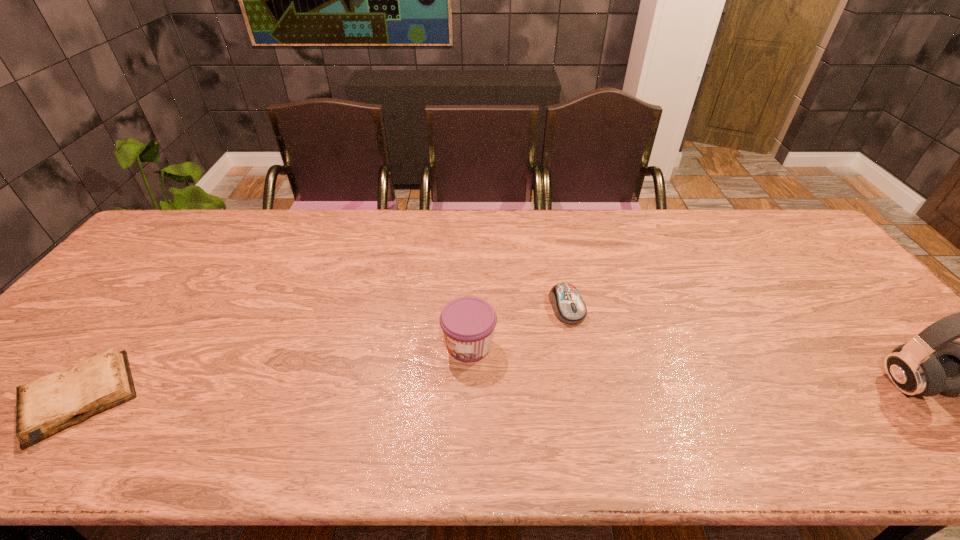
Locate an element on the screen. This screenshot has height=540, width=960. free spot on the desktop that is between the leftmost object and the rightmost object and is positioned on the wheel side of the second object from right to left is located at coordinates (608, 389).

The image size is (960, 540). Identify the location of vacant space on the desktop that is between the shortest object and the headset and is positioned on the front label of the third object from right to left. (390, 392).